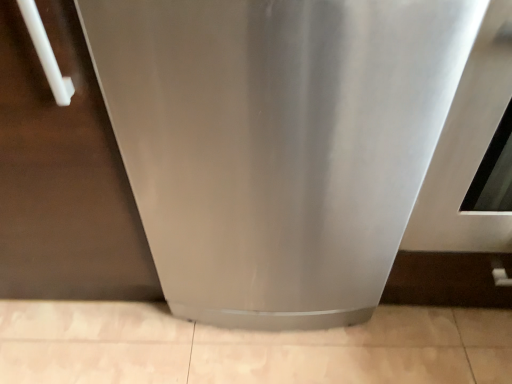
This screenshot has width=512, height=384. Describe the element at coordinates (63, 176) in the screenshot. I see `satin silver refrigerator at lower left` at that location.

Locate an element on the screen. satin silver refrigerator at lower left is located at coordinates (63, 176).

Describe the element at coordinates (298, 144) in the screenshot. This screenshot has height=384, width=512. I see `stainless steel refrigerator at center` at that location.

Locate an element on the screen. stainless steel refrigerator at center is located at coordinates (298, 144).

Locate an element on the screen. This screenshot has height=384, width=512. satin silver refrigerator at lower left is located at coordinates (63, 176).

Based on the photo, does stainless steel refrigerator at center appear on the left side of satin silver refrigerator at lower left?

Incorrect, stainless steel refrigerator at center is not on the left side of satin silver refrigerator at lower left.

Is stainless steel refrigerator at center in front of or behind satin silver refrigerator at lower left in the image?

Visually, stainless steel refrigerator at center is located in front of satin silver refrigerator at lower left.

Which is nearer, (164,18) or (77,104)?

Clearly, point (164,18) is closer to the camera than point (77,104).

From the image's perspective, relative to satin silver refrigerator at lower left, is stainless steel refrigerator at center above or below?

stainless steel refrigerator at center is situated higher than satin silver refrigerator at lower left in the image.

From a real-world perspective, is stainless steel refrigerator at center physically located above or below satin silver refrigerator at lower left?

In terms of real-world spatial position, stainless steel refrigerator at center is above satin silver refrigerator at lower left.

Which of these two, stainless steel refrigerator at center or satin silver refrigerator at lower left, is thinner?

With smaller width is satin silver refrigerator at lower left.

Considering the sizes of objects stainless steel refrigerator at center and satin silver refrigerator at lower left in the image provided, who is shorter, stainless steel refrigerator at center or satin silver refrigerator at lower left?

With less height is satin silver refrigerator at lower left.

Considering the relative sizes of stainless steel refrigerator at center and satin silver refrigerator at lower left in the image provided, is stainless steel refrigerator at center bigger than satin silver refrigerator at lower left?

No, stainless steel refrigerator at center is not bigger than satin silver refrigerator at lower left.

Could satin silver refrigerator at lower left be considered to be inside stainless steel refrigerator at center?

That's incorrect, satin silver refrigerator at lower left is not inside stainless steel refrigerator at center.

Are stainless steel refrigerator at center and satin silver refrigerator at lower left making contact?

They are not placed beside each other.

Is stainless steel refrigerator at center facing towards satin silver refrigerator at lower left?

No, stainless steel refrigerator at center is not oriented towards satin silver refrigerator at lower left.

From the picture: Measure the distance from stainless steel refrigerator at center to satin silver refrigerator at lower left.

stainless steel refrigerator at center and satin silver refrigerator at lower left are 9.11 inches apart.

Locate an element on the screen. door below the stainless steel refrigerator at center (from a real-world perspective) is located at coordinates (63, 176).

Looking at this image, considering the relative positions of satin silver refrigerator at lower left and stainless steel refrigerator at center in the image provided, is satin silver refrigerator at lower left to the left of stainless steel refrigerator at center from the viewer's perspective?

Yes.

Looking at this image, between satin silver refrigerator at lower left and stainless steel refrigerator at center, which one is positioned behind?

satin silver refrigerator at lower left is behind.

Is point (52, 16) closer to camera compared to point (446, 115)?

Yes.

From the picture: From the image's perspective, is satin silver refrigerator at lower left under stainless steel refrigerator at center?

Yes, from the image's perspective, satin silver refrigerator at lower left is below stainless steel refrigerator at center.

From a real-world perspective, does satin silver refrigerator at lower left sit lower than stainless steel refrigerator at center?

Yes.

In terms of width, does satin silver refrigerator at lower left look wider or thinner when compared to stainless steel refrigerator at center?

Clearly, satin silver refrigerator at lower left has less width compared to stainless steel refrigerator at center.

Considering the sizes of objects satin silver refrigerator at lower left and stainless steel refrigerator at center in the image provided, who is shorter, satin silver refrigerator at lower left or stainless steel refrigerator at center?

With less height is satin silver refrigerator at lower left.

Who is bigger, satin silver refrigerator at lower left or stainless steel refrigerator at center?

With larger size is satin silver refrigerator at lower left.

Is satin silver refrigerator at lower left situated inside stainless steel refrigerator at center or outside?

satin silver refrigerator at lower left is not inside stainless steel refrigerator at center, it's outside.

Is satin silver refrigerator at lower left not near stainless steel refrigerator at center?

No, satin silver refrigerator at lower left is not far from stainless steel refrigerator at center.

Is satin silver refrigerator at lower left turned away from stainless steel refrigerator at center?

No, satin silver refrigerator at lower left is not facing away from stainless steel refrigerator at center.

How far apart are satin silver refrigerator at lower left and stainless steel refrigerator at center?

The distance of satin silver refrigerator at lower left from stainless steel refrigerator at center is 9.11 inches.

You are a GUI agent. You are given a task and a screenshot of the screen. Output one action in this format:
    pyautogui.click(x=<x>, y=<y>)
    Task: Click on the door below the stainless steel refrigerator at center (from the image's perspective)
    
    Given the screenshot: What is the action you would take?
    pyautogui.click(x=63, y=176)

Find the location of a particular element. This screenshot has height=384, width=512. door below the stainless steel refrigerator at center (from the image's perspective) is located at coordinates (63, 176).

At what (x,y) coordinates should I click in order to perform the action: click on home appliance above the satin silver refrigerator at lower left (from the image's perspective). Please return your answer as a coordinate pair (x, y). The image size is (512, 384). Looking at the image, I should click on click(298, 144).